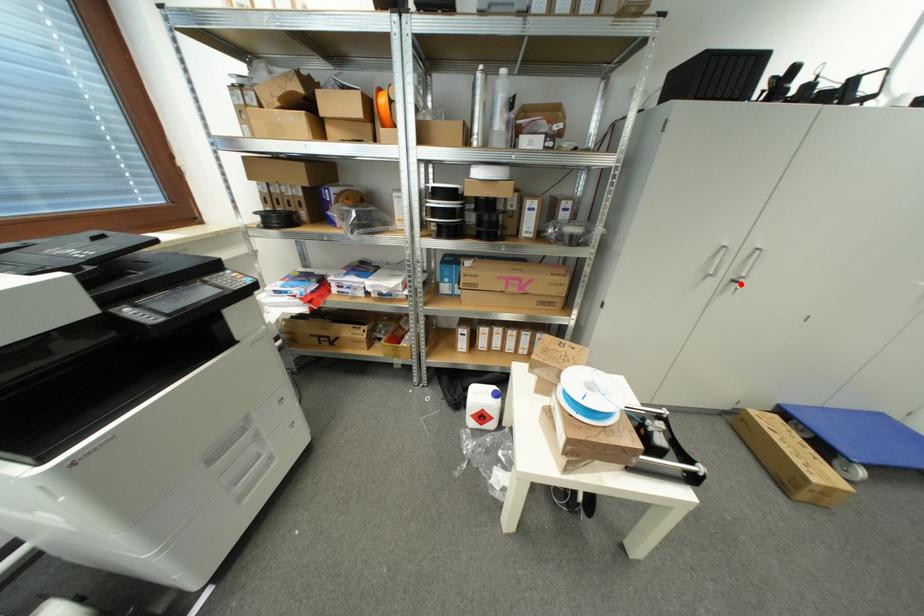
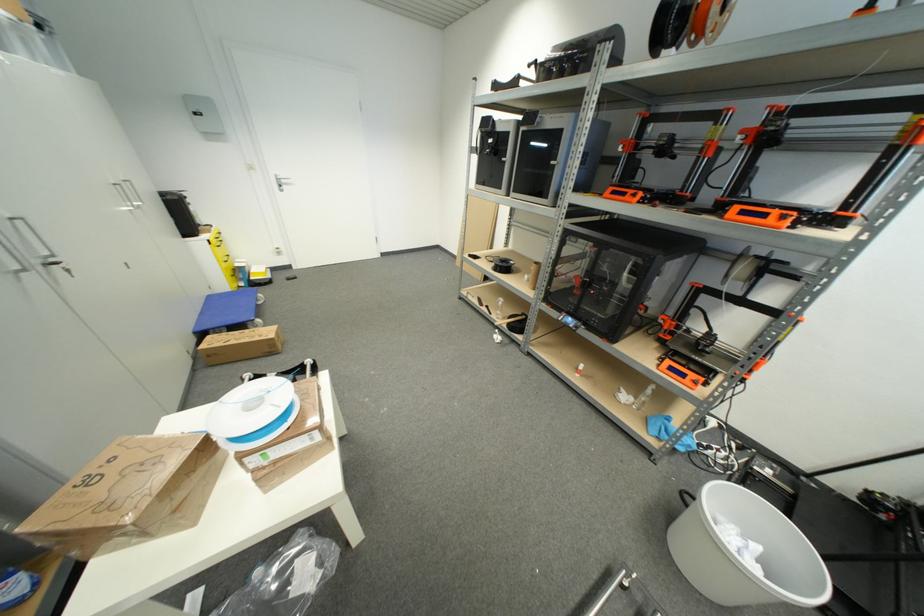
Question: I am providing you with two images of the same scene from different viewpoints. Image1 has a red point marked. In image2, the corresponding 3D location appears at what relative position? Reply with the corresponding letter.

Choices:
 (A) Closer
 (B) Farther

Answer: (B)